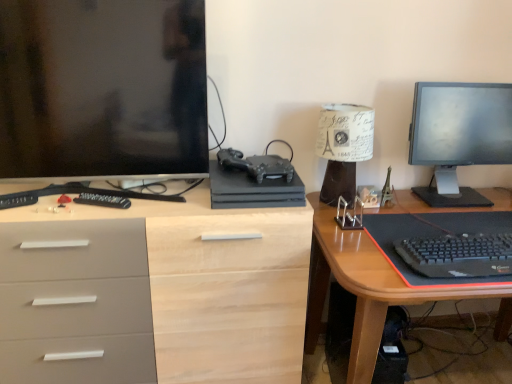
Identify the location of vacant space underneath matte black monitor at left (from a real-world perspective). This screenshot has height=384, width=512. (145, 192).